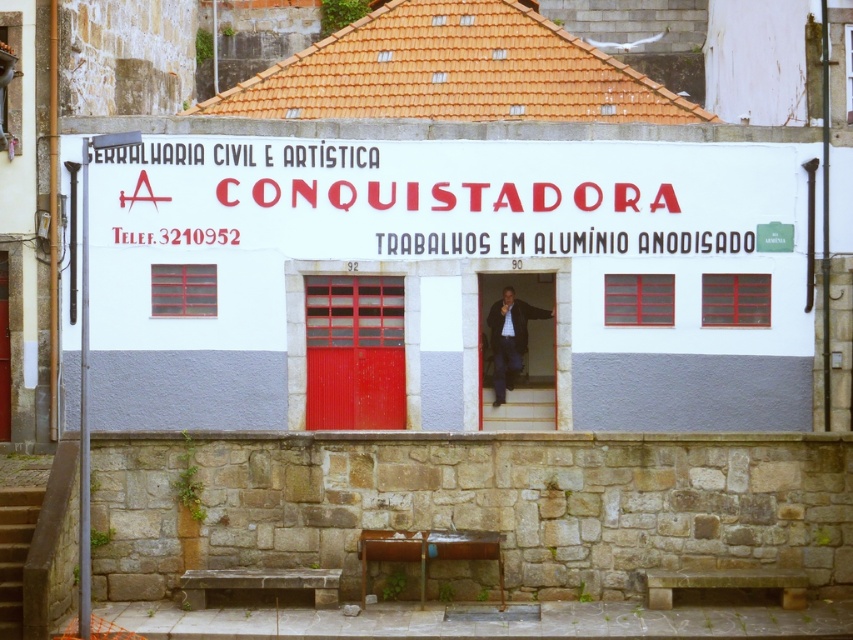
Can you confirm if white painted wall at center is bigger than red painted wooden door at center?

Indeed, white painted wall at center has a larger size compared to red painted wooden door at center.

Who is shorter, white painted wall at center or red painted wooden door at center?

red painted wooden door at center is shorter.

Is point (357, 337) less distant than point (482, 380)?

Yes, point (357, 337) is closer to viewer.

Where is `white painted wall at center`? The height and width of the screenshot is (640, 853). white painted wall at center is located at coordinates (447, 278).

What do you see at coordinates (447, 278) in the screenshot? This screenshot has width=853, height=640. I see `white painted wall at center` at bounding box center [447, 278].

Can you confirm if white painted wall at center is positioned above metallic red door at center?

Yes, white painted wall at center is above metallic red door at center.

What do you see at coordinates (447, 278) in the screenshot? The height and width of the screenshot is (640, 853). I see `white painted wall at center` at bounding box center [447, 278].

Image resolution: width=853 pixels, height=640 pixels. Identify the location of white painted wall at center. (447, 278).

Between white painted wall at center and white painted signboard at center, which one appears on the left side from the viewer's perspective?

white painted wall at center is more to the left.

Is point (180, 401) less distant than point (242, 172)?

No, (180, 401) is behind (242, 172).

Which is behind, point (628, 176) or point (311, 164)?

Point (311, 164)

Identify the location of white painted wall at center. (447, 278).